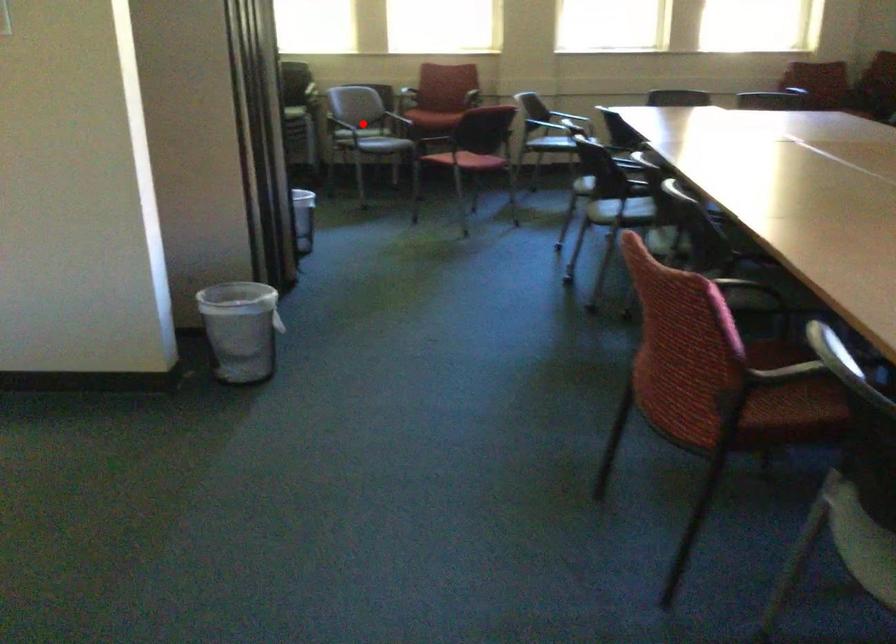
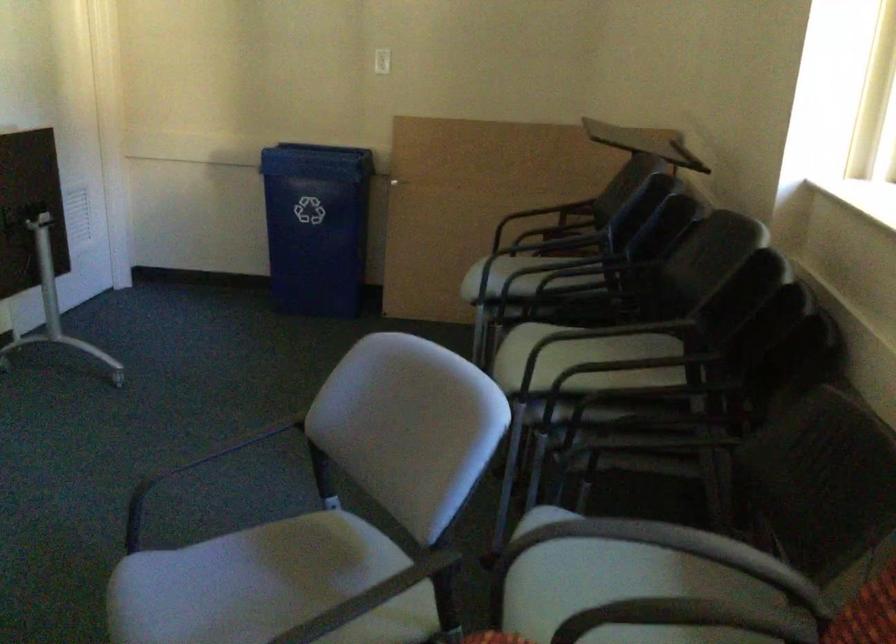
Locate, in the second image, the point that corresponds to the highlighted location in the first image.

(230, 446)